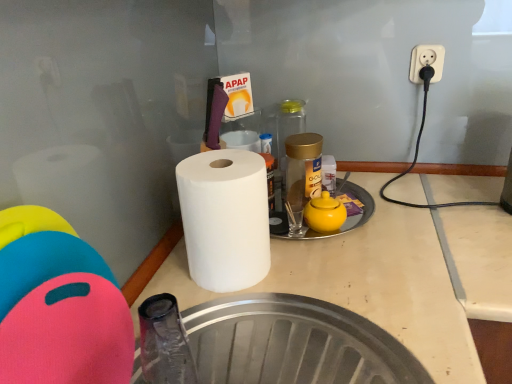
Image resolution: width=512 pixels, height=384 pixels. Identify the location of vacant space situated on the left part of yellow matte teapot at center. (286, 227).